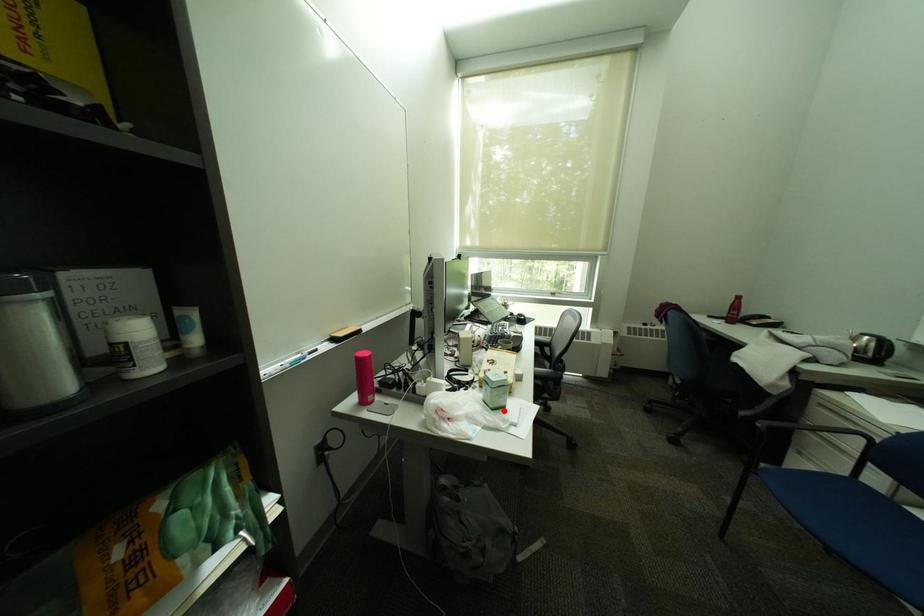
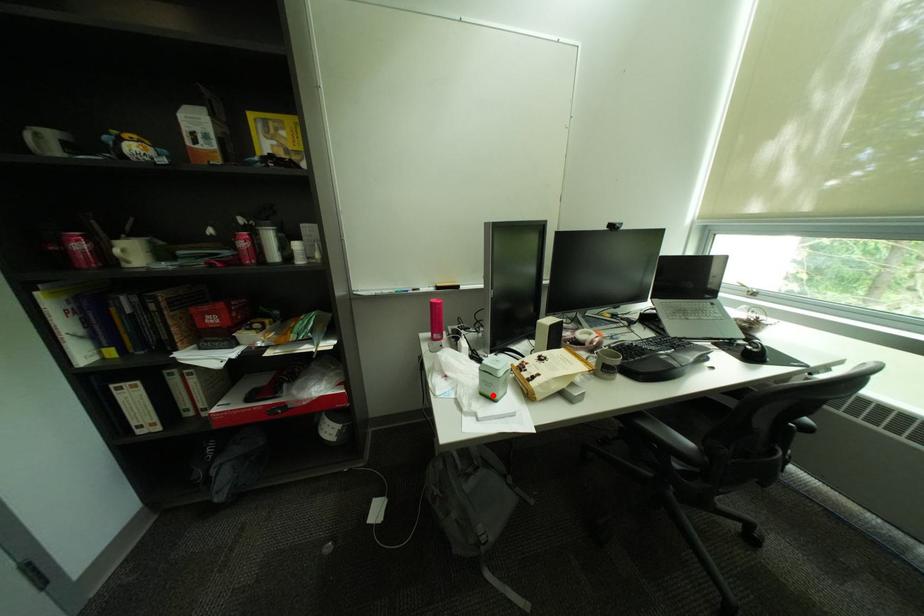
I am providing you with two images of the same scene from different viewpoints. A red point is marked on the first image and another point is marked on the second image. Are the points marked in image1 and image2 representing the same 3D position?

Yes